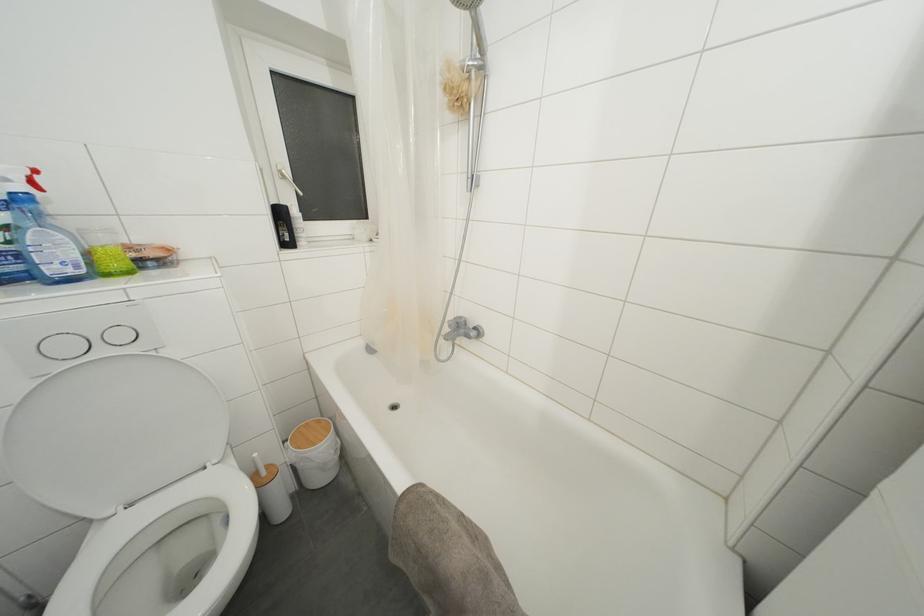
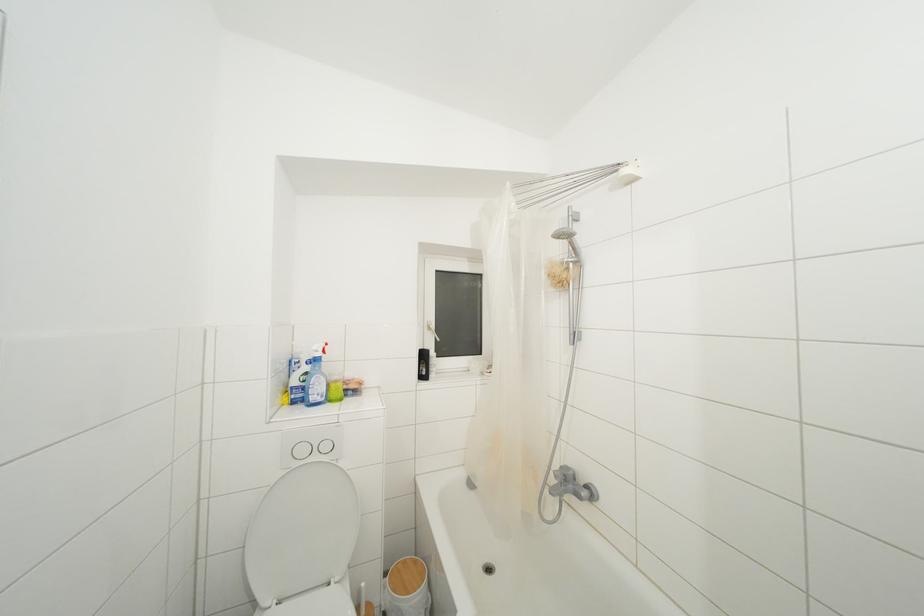
In the second image, find the point that corresponds to the point at 273,471 in the first image.

(371, 610)